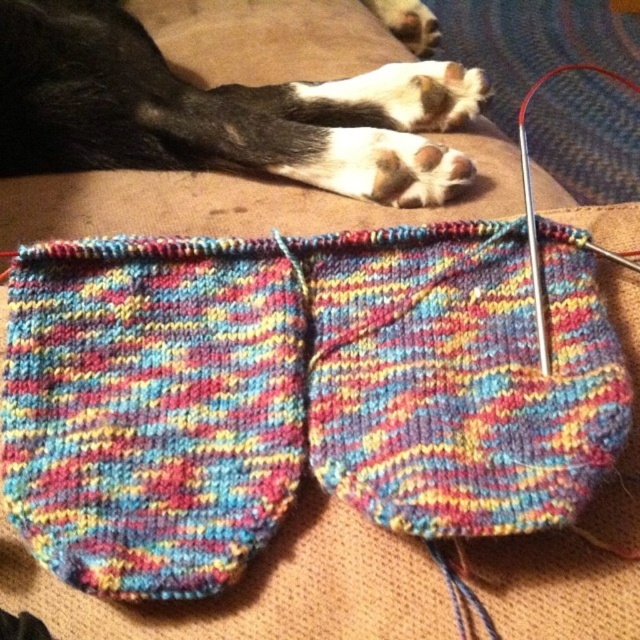
Which is behind, point (42, 492) or point (538, 252)?

The point (538, 252) is more distant.

Where is `multicolored knitted sock at center`? This screenshot has width=640, height=640. multicolored knitted sock at center is located at coordinates (152, 406).

Based on the photo, who is more distant from viewer, [220,492] or [428,93]?

Point [428,93]

Which is more to the left, multicolored knitted sock at center or black fur paw at upper left?

Result: multicolored knitted sock at center is more to the left.

Does point (236, 260) come behind point (54, 129)?

No, (236, 260) is in front of (54, 129).

Where is `multicolored knitted sock at center`? multicolored knitted sock at center is located at coordinates 152,406.

Who is positioned more to the left, black fur paw at upper left or metallic silver knitting needle at upper right?

black fur paw at upper left

Is black fur paw at upper left wider than metallic silver knitting needle at upper right?

Indeed, black fur paw at upper left has a greater width compared to metallic silver knitting needle at upper right.

Is point (88, 90) positioned behind point (624, 76)?

No, it is in front of (624, 76).

This screenshot has height=640, width=640. I want to click on black fur paw at upper left, so click(x=218, y=112).